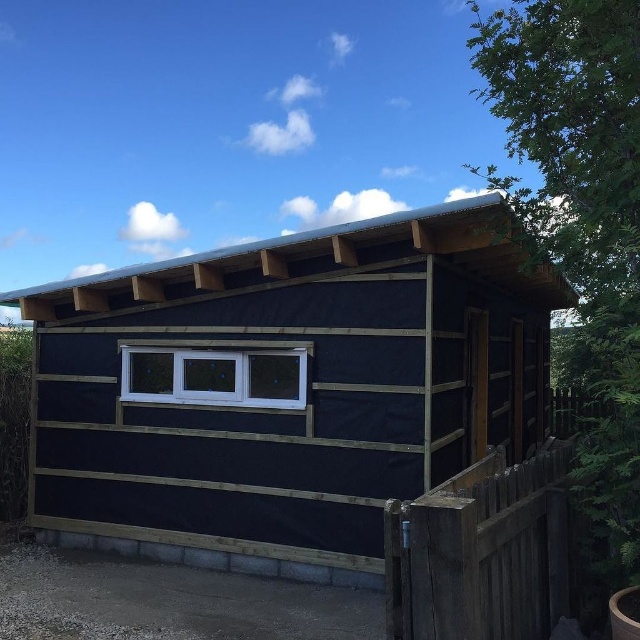
Question: Which of the following is the farthest from the observer?

Choices:
 (A) (460, 340)
 (B) (300, 349)
 (C) (557, 541)

Answer: (A)

Question: From the image, what is the correct spatial relationship of weathered wood fence at right in relation to white plastic window at center?

Choices:
 (A) above
 (B) below

Answer: (B)

Question: Which object appears closest to the camera in this image?

Choices:
 (A) weathered wood fence at right
 (B) black wood hut at center

Answer: (A)

Question: Does black wood hut at center lie behind white plastic window at center?

Choices:
 (A) no
 (B) yes

Answer: (B)

Question: Among these points, which one is farthest from the camera?

Choices:
 (A) (74, 392)
 (B) (436, 545)
 (C) (132, 358)

Answer: (A)

Question: Is black wood hut at center smaller than white plastic window at center?

Choices:
 (A) yes
 (B) no

Answer: (A)